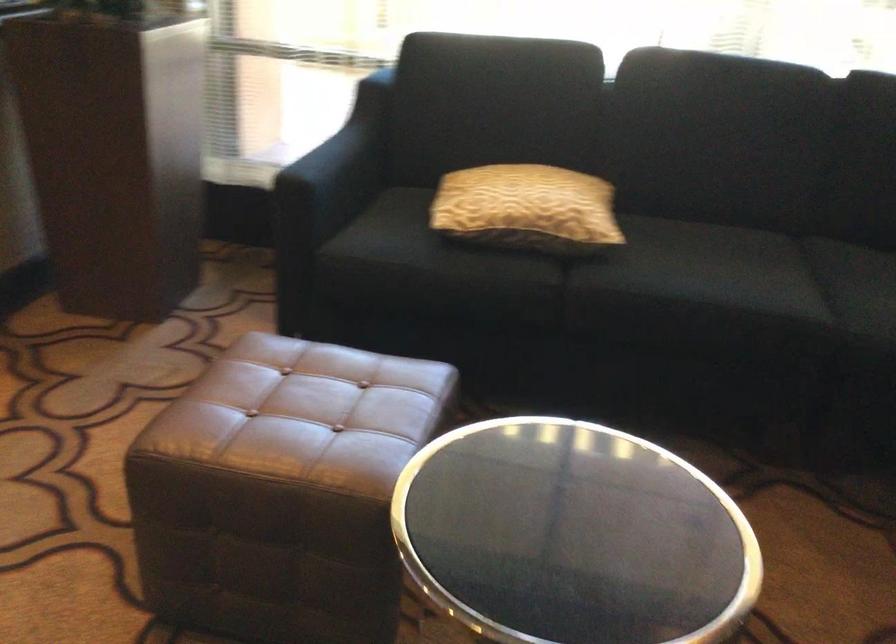
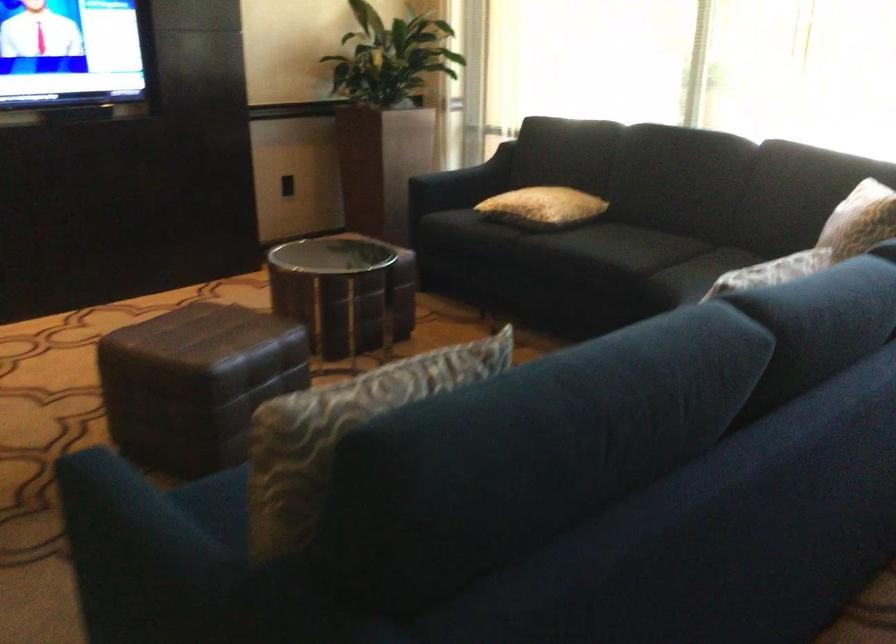
Locate, in the second image, the point that corresponds to (x=567, y=216) in the first image.

(543, 207)